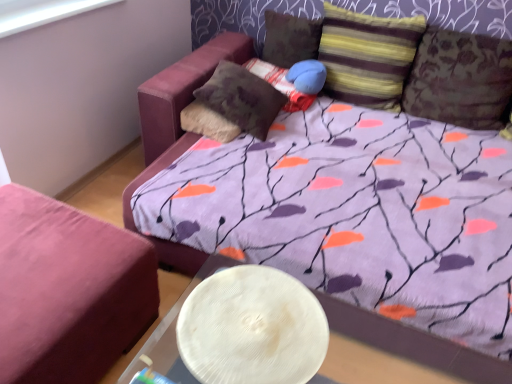
Question: Is textured brown pillow at upper right, the fifth pillow when ordered from left to right, at the back of striped fabric pillow at upper right, the fourth pillow in the left-to-right sequence?

Choices:
 (A) yes
 (B) no

Answer: (B)

Question: Can you confirm if striped fabric pillow at upper right, the second pillow viewed from the right, is smaller than textured brown pillow at upper right, the fifth pillow when ordered from left to right?

Choices:
 (A) yes
 (B) no

Answer: (B)

Question: Is the depth of striped fabric pillow at upper right, the fourth pillow in the left-to-right sequence, less than that of textured brown pillow at upper right, the fifth pillow when ordered from left to right?

Choices:
 (A) yes
 (B) no

Answer: (B)

Question: From the image's perspective, is striped fabric pillow at upper right, the fourth pillow in the left-to-right sequence, beneath textured brown pillow at upper right, placed as the first pillow when sorted from right to left?

Choices:
 (A) no
 (B) yes

Answer: (A)

Question: Is striped fabric pillow at upper right, the fourth pillow in the left-to-right sequence, further to camera compared to textured brown pillow at upper right, placed as the first pillow when sorted from right to left?

Choices:
 (A) yes
 (B) no

Answer: (A)

Question: From the image's perspective, is textured brown pillow at upper right, placed as the first pillow when sorted from right to left, positioned above or below textured brown pillow at center, positioned as the 5th pillow in right-to-left order?

Choices:
 (A) above
 (B) below

Answer: (A)

Question: From a real-world perspective, relative to textured brown pillow at center, positioned as the 5th pillow in right-to-left order, is textured brown pillow at upper right, placed as the first pillow when sorted from right to left, vertically above or below?

Choices:
 (A) above
 (B) below

Answer: (A)

Question: Considering the positions of textured brown pillow at upper right, the fifth pillow when ordered from left to right, and textured brown pillow at center, positioned as the 5th pillow in right-to-left order, in the image, is textured brown pillow at upper right, the fifth pillow when ordered from left to right, wider or thinner than textured brown pillow at center, positioned as the 5th pillow in right-to-left order,?

Choices:
 (A) thin
 (B) wide

Answer: (A)

Question: Considering the positions of textured brown pillow at upper right, placed as the first pillow when sorted from right to left, and textured brown pillow at center, the first pillow viewed from the left, in the image, is textured brown pillow at upper right, placed as the first pillow when sorted from right to left, taller or shorter than textured brown pillow at center, the first pillow viewed from the left,?

Choices:
 (A) tall
 (B) short

Answer: (A)

Question: From the image's perspective, is textured brown pillow at center, positioned as the 5th pillow in right-to-left order, positioned above or below velvet-like brown pillow at center, the 4th pillow when ordered from right to left?

Choices:
 (A) above
 (B) below

Answer: (B)

Question: In the image, is textured brown pillow at center, positioned as the 5th pillow in right-to-left order, positioned in front of or behind velvet-like brown pillow at center, placed as the second pillow when sorted from left to right?

Choices:
 (A) behind
 (B) front

Answer: (B)

Question: Looking at their shapes, would you say textured brown pillow at center, the first pillow viewed from the left, is wider or thinner than velvet-like brown pillow at center, the 4th pillow when ordered from right to left?

Choices:
 (A) wide
 (B) thin

Answer: (A)

Question: Is point (208, 92) positioned closer to the camera than point (293, 91)?

Choices:
 (A) farther
 (B) closer

Answer: (B)

Question: Considering the positions of point (461, 81) and point (56, 8), is point (461, 81) closer or farther from the camera than point (56, 8)?

Choices:
 (A) closer
 (B) farther

Answer: (B)

Question: Considering their positions, is textured brown pillow at upper right, placed as the first pillow when sorted from right to left, located in front of or behind white plastic window screen at upper left?

Choices:
 (A) behind
 (B) front

Answer: (A)